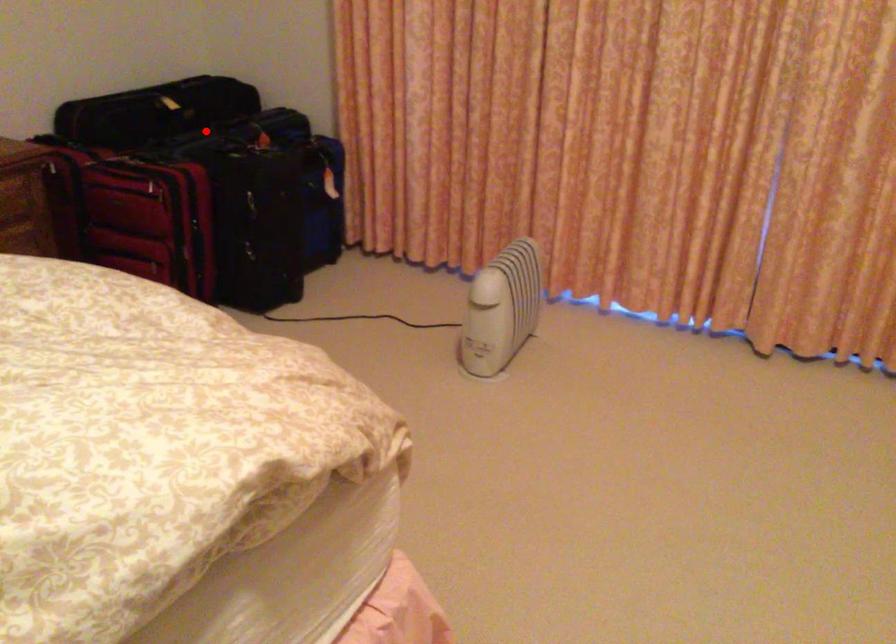
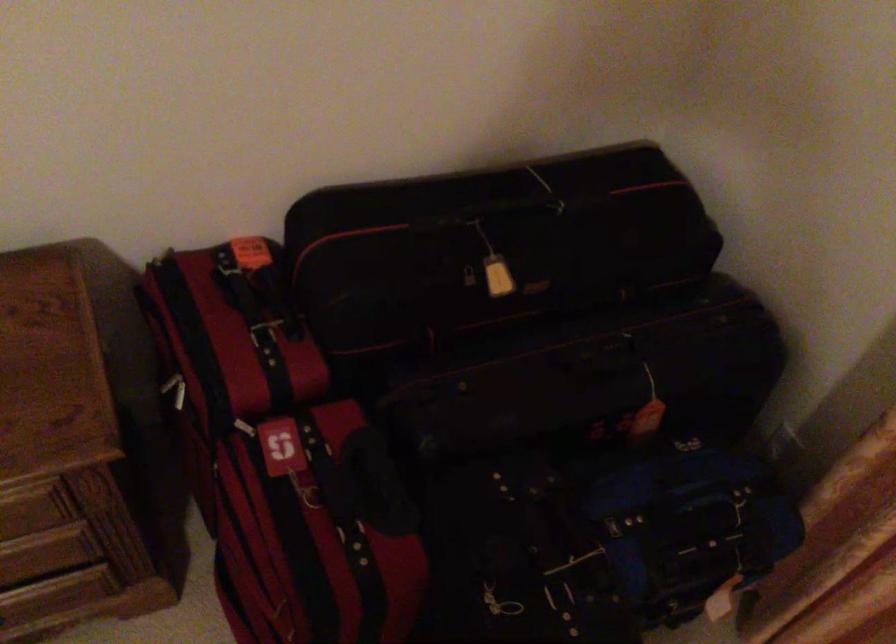
Locate, in the second image, the point that corresponds to the highlighted location in the first image.

(527, 357)